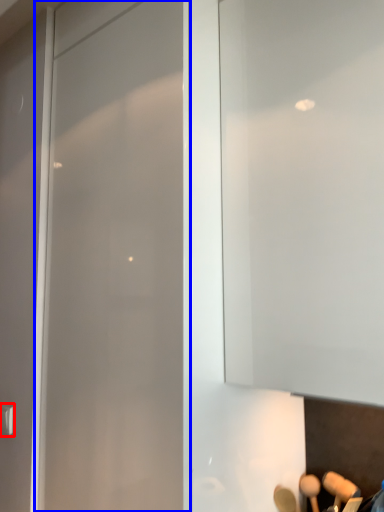
Question: Which of the following is the closest to the observer, door handle (highlighted by a red box) or glass door (highlighted by a blue box)?

Choices:
 (A) door handle
 (B) glass door

Answer: (B)